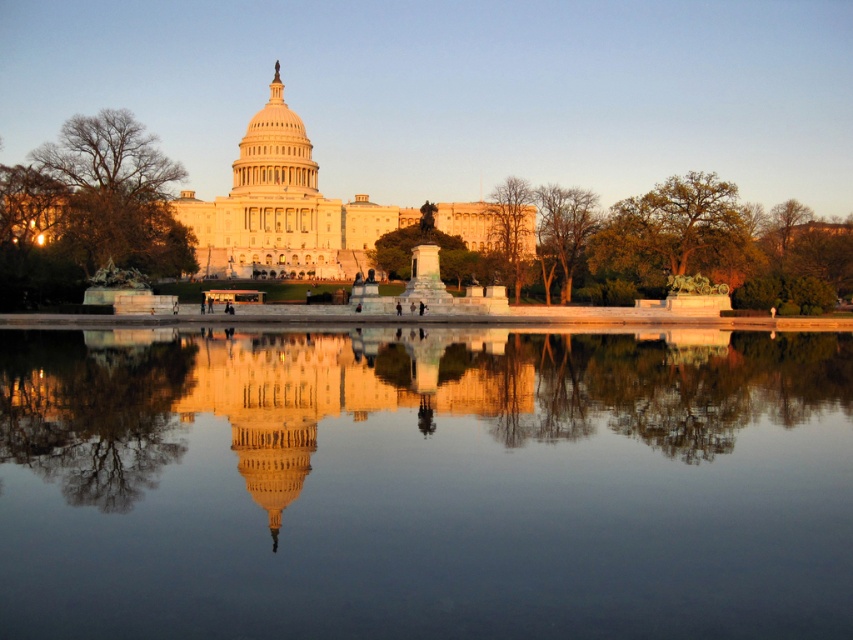
Question: Can you confirm if transparent glass water at center is positioned to the left of green leafy tree at center?

Choices:
 (A) no
 (B) yes

Answer: (B)

Question: Does bare branches at center come behind green leafy tree at center?

Choices:
 (A) no
 (B) yes

Answer: (B)

Question: Which point is farther to the camera?

Choices:
 (A) (137, 141)
 (B) (587, 216)
 (C) (750, 259)
 (D) (527, 252)

Answer: (D)

Question: Among these objects, which one is farthest from the camera?

Choices:
 (A) green leafy tree at center
 (B) bare branches at center
 (C) transparent glass water at center

Answer: (B)

Question: Does transparent glass water at center appear on the right side of bare branches at left?

Choices:
 (A) no
 (B) yes

Answer: (B)

Question: Which is nearer to the green leafy tree at right?

Choices:
 (A) bare branches at center
 (B) bare branches at left

Answer: (A)